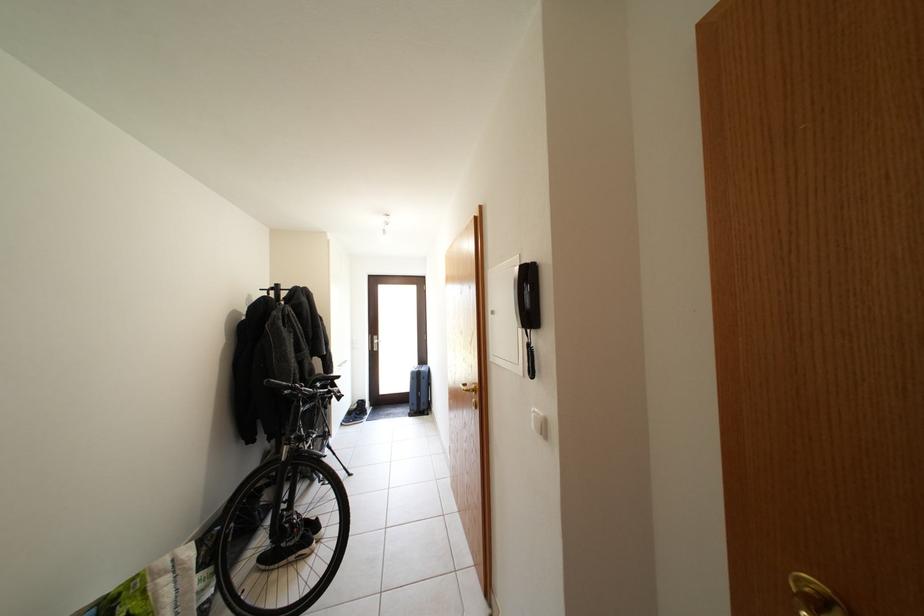
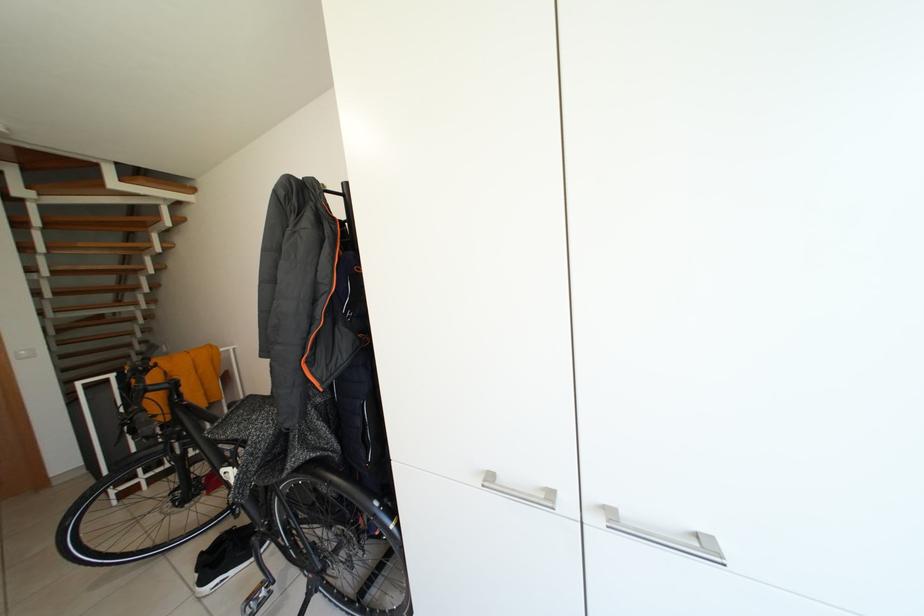
Question: I am providing you with two images of the same scene from different viewpoints. Please identify which objects are invisible in image2.

Choices:
 (A) patterned brown ottoman
 (B) bicycle handlebar grip
 (C) silver cabinet handle
 (D) black coat rack post

Answer: (D)